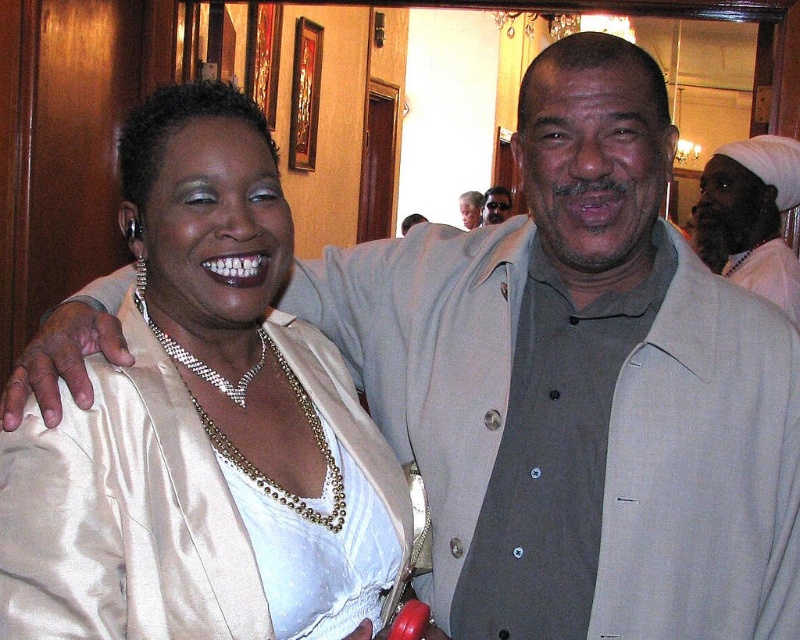
Question: Which point is closer to the camera?

Choices:
 (A) (490, 211)
 (B) (796, 196)
 (C) (40, 563)
 (D) (405, 232)

Answer: (C)

Question: Considering the relative positions of matte gray suit at upper center and matte beige suit at upper center in the image provided, where is matte gray suit at upper center located with respect to matte beige suit at upper center?

Choices:
 (A) above
 (B) below

Answer: (A)

Question: Which point is farther from the camera taking this photo?

Choices:
 (A) (776, 243)
 (B) (408, 216)
 (C) (352, 458)

Answer: (B)

Question: Which object is the farthest from the beige satin jacket at upper center?

Choices:
 (A) white satin turban at upper right
 (B) matte gray suit at upper center
 (C) matte beige suit at upper center
 (D) satin white blouse at center

Answer: (D)

Question: Does white satin turban at upper right appear on the left side of beige satin jacket at upper center?

Choices:
 (A) no
 (B) yes

Answer: (A)

Question: Can you confirm if satin white blouse at center is smaller than beige satin jacket at upper center?

Choices:
 (A) no
 (B) yes

Answer: (A)